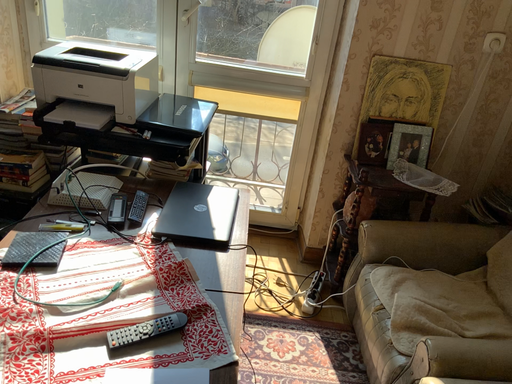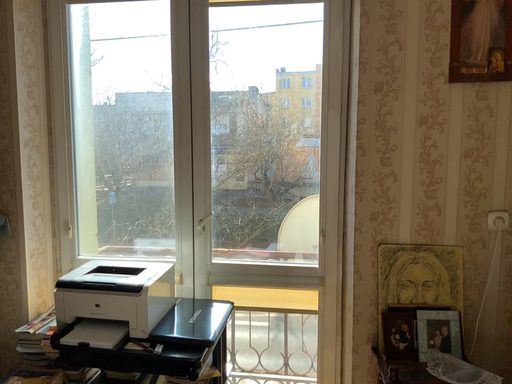
Question: How did the camera likely rotate when shooting the video?

Choices:
 (A) rotated upward
 (B) rotated downward

Answer: (A)